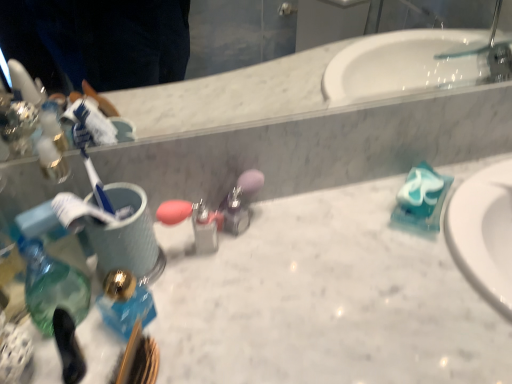
At what (x,y) coordinates should I click in order to perform the action: click on free space above white marble counter top at center (from a real-world perspective). Please return your answer as a coordinate pair (x, y). The height and width of the screenshot is (384, 512). Looking at the image, I should click on (320, 280).